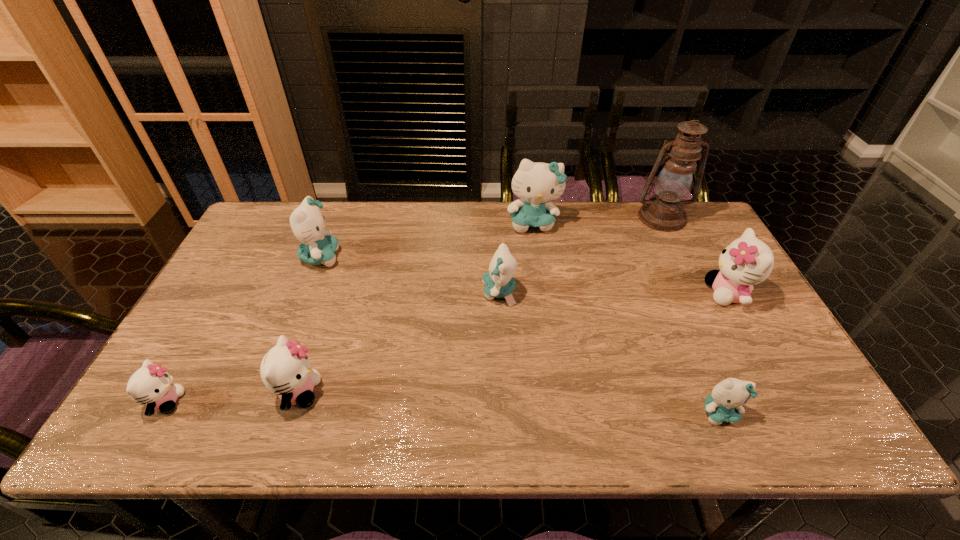
Locate which blue kitten ranks second in proximity to the second farthest blue kitten. Please provide its 2D coordinates. Your answer should be formatted as a tuple, i.e. [(x, y)], where the tuple contains the x and y coordinates of a point satisfying the conditions above.

[(536, 184)]

The image size is (960, 540). Find the location of `blue kitten that stands as the third closest to the rightmost kitten`. blue kitten that stands as the third closest to the rightmost kitten is located at coordinates (498, 282).

Locate an element on the screen. The height and width of the screenshot is (540, 960). the closest white kitten to the second smallest blue kitten is located at coordinates (285, 369).

Locate which white kitten ranks in proximity to the second smallest white kitten. Please provide its 2D coordinates. Your answer should be formatted as a tuple, i.e. [(x, y)], where the tuple contains the x and y coordinates of a point satisfying the conditions above.

[(151, 384)]

The width and height of the screenshot is (960, 540). What are the coordinates of `vacant space that satisfies the following two spatial constraints: 1. on the front-facing side of the rightmost kitten; 2. on the face of the sixth kitten from left to right` in the screenshot? It's located at (795, 413).

Identify the location of vacant space that satisfies the following two spatial constraints: 1. on the front-facing side of the rightmost white kitten; 2. on the face of the second kitten from right to left. pyautogui.click(x=795, y=413).

Locate an element on the screen. The width and height of the screenshot is (960, 540). vacant space that satisfies the following two spatial constraints: 1. on the front side of the tallest object; 2. on the front-facing side of the leftmost object is located at coordinates (753, 402).